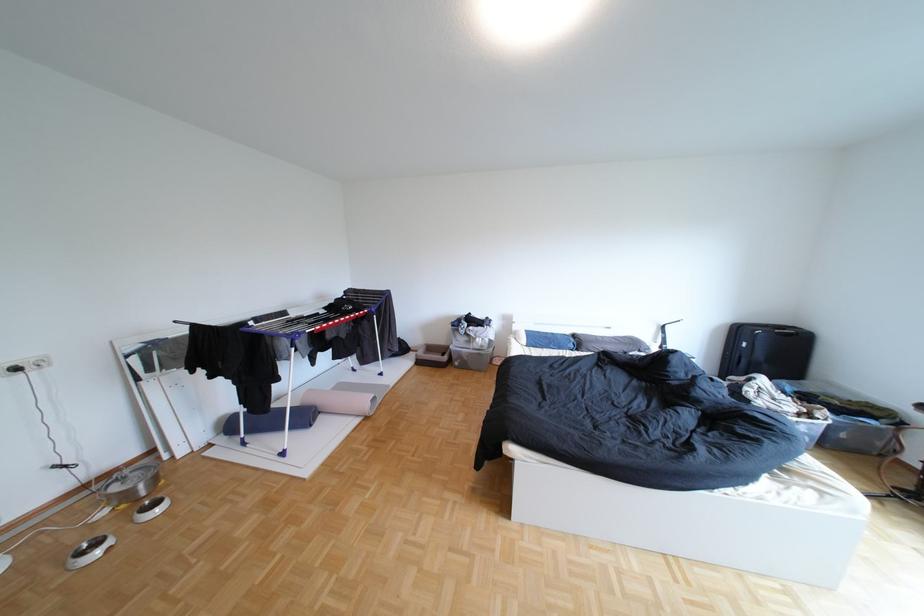
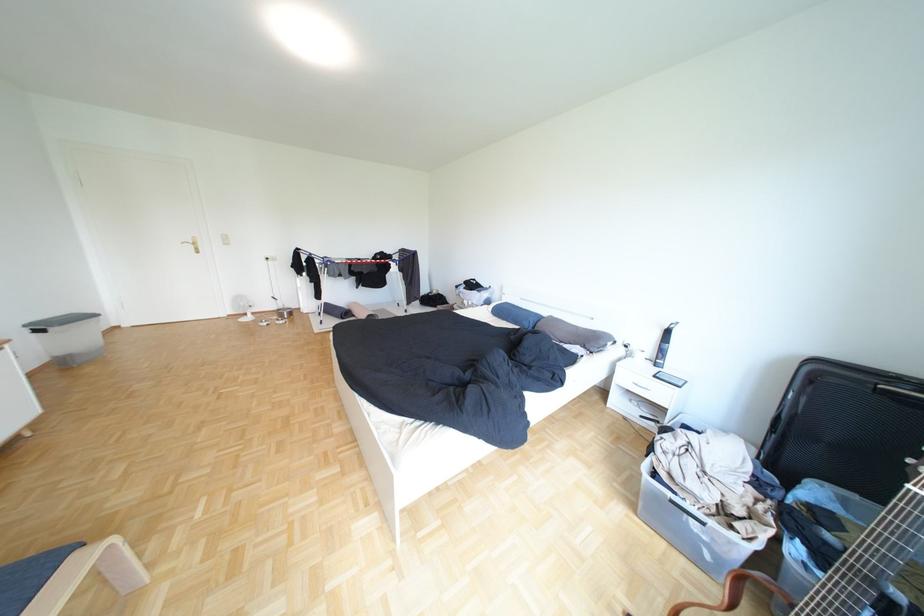
Locate, in the second image, the point that corresponds to point 590,336 in the first image.

(564, 318)